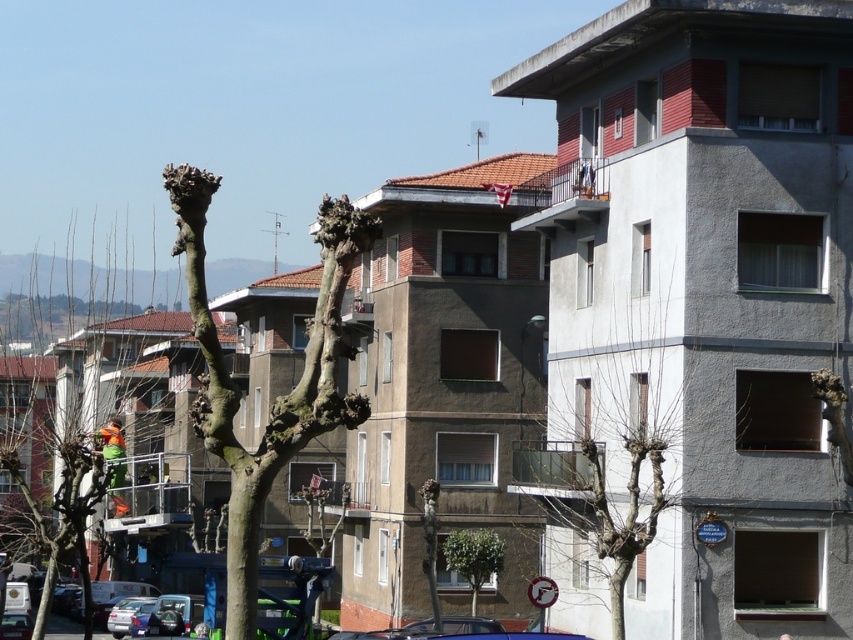
Question: Can you confirm if bare branches at center is positioned to the right of green leafy tree at center?

Choices:
 (A) no
 (B) yes

Answer: (B)

Question: Considering the real-world distances, which object is closest to the metallic silver car at lower left?

Choices:
 (A) bare branches at left
 (B) barky brown tree at center

Answer: (B)

Question: Which of these objects is positioned closest to the green reflective safety vest at center?

Choices:
 (A) metallic silver car at lower left
 (B) green leafy tree at center
 (C) bare branches at center

Answer: (A)

Question: Observing the image, what is the correct spatial positioning of metallic silver car at lower left in reference to silver metallic sedan at lower left?

Choices:
 (A) above
 (B) below

Answer: (A)

Question: Can you confirm if green leafy tree at center is positioned below silver metallic sedan at lower left?

Choices:
 (A) no
 (B) yes

Answer: (A)

Question: Which point is farther to the camera?

Choices:
 (A) (51, 516)
 (B) (585, 403)
 (C) (138, 621)
 (D) (128, 628)

Answer: (A)